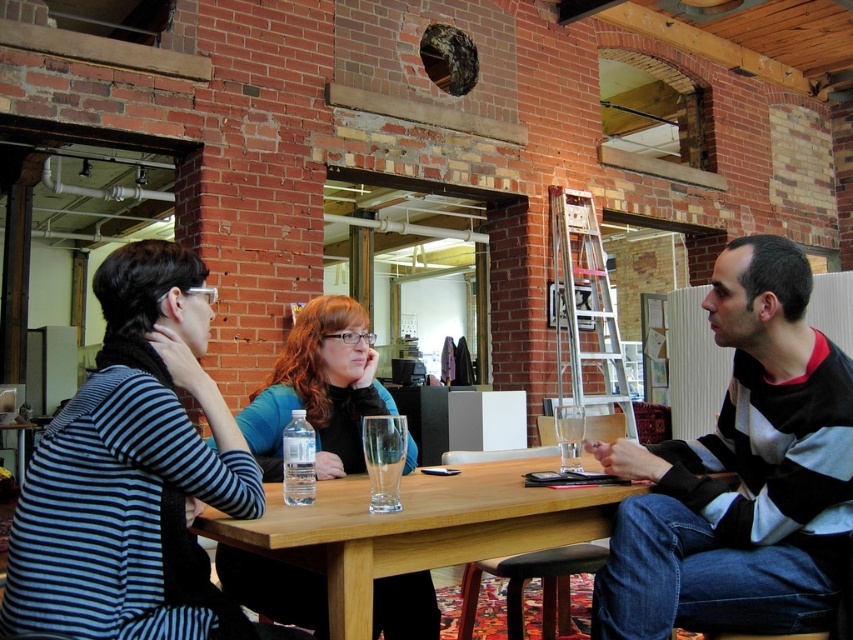
You are sitting at the wooden table at center and want to pass a note to the person wearing the striped sweater at center. In which direction should you slide the note on the table to reach them?

The striped sweater at center is positioned on the right side of the wooden table at center, so you should slide the note to the right side of the wooden table at center to reach them.

You are organizing a clothing donation drive and need to know which of the two shirts, the striped fabric shirt at left or the blue matte shirt at center, is narrower to fit into a smaller donation box. Which one should you choose?

The striped fabric shirt at left is narrower than the blue matte shirt at center, so you should choose the striped fabric shirt at left for the smaller donation box.

You are a delivery person who needs to place a small package on the table between the striped fabric shirt at left and the clear plastic bottle at table center. Is there enough space for the package?

The distance between the striped fabric shirt at left and the clear plastic bottle at table center is 10.60 inches. If the package is smaller than this distance, it can be placed there.